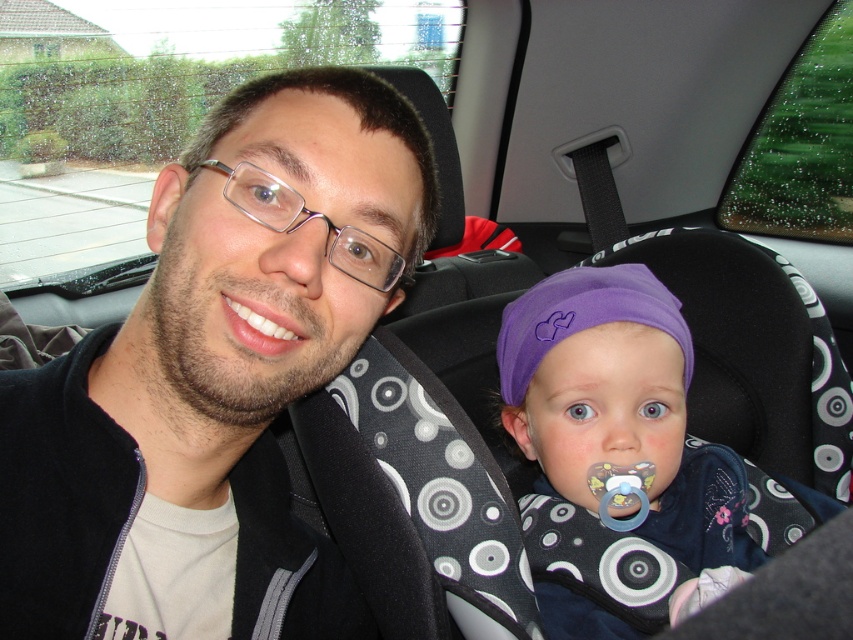
You are inside a car with an adult and a baby. The adult is on the left side wearing a black jacket, and the baby is on the right in a car seat with a purple headband. A point at coordinates (218,364) is marked. According to the scene, what object is located at that point?

The point at coordinates (218,364) marks the matte black jacket at center.

You are a passenger in the car and need to locate the matte black jacket at center. Where exactly is it positioned in the car?

The matte black jacket at center is positioned at coordinates point (x=218, y=364).

You are a safety inspector checking the distance between the matte black jacket at center and the purple fabric headband at center in a car. The safety regulation requires that these two items must be at least 12 inches apart to prevent interference during emergencies. Based on the image, is the current distance compliant with the regulation?

The matte black jacket at center is 10.53 inches from the purple fabric headband at center. Since 10.53 inches is less than the required 12 inches, the current distance does not comply with the safety regulation.